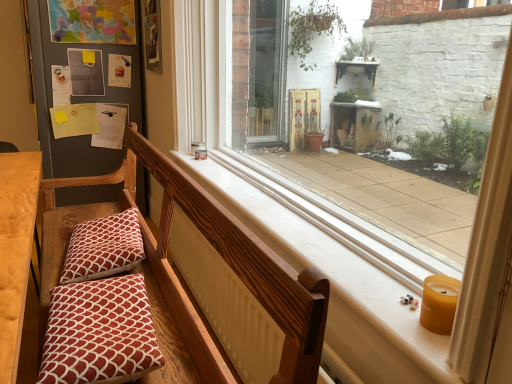
Where is `free spot below smooth white window sill at center (from a real-world perspective)`? Image resolution: width=512 pixels, height=384 pixels. free spot below smooth white window sill at center (from a real-world perspective) is located at coordinates (298, 206).